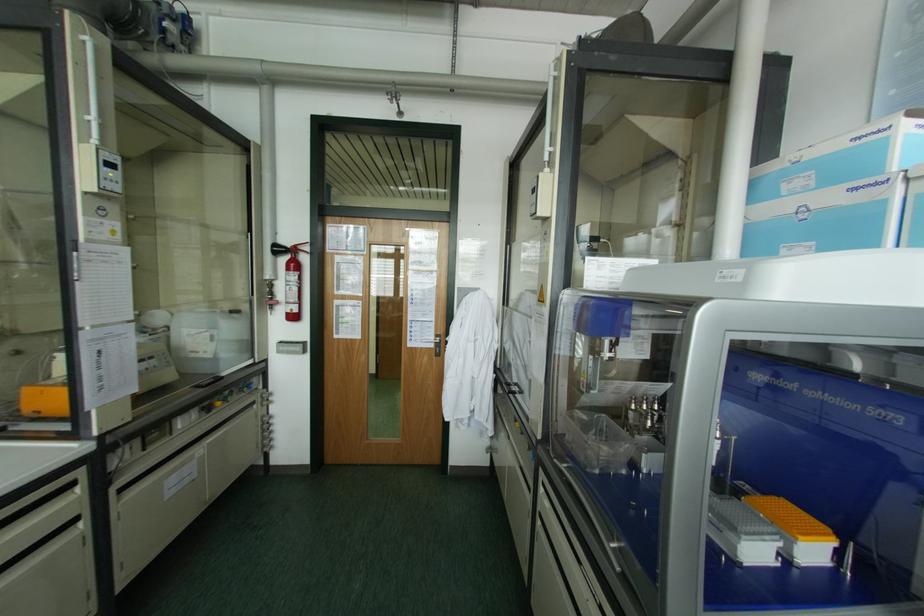
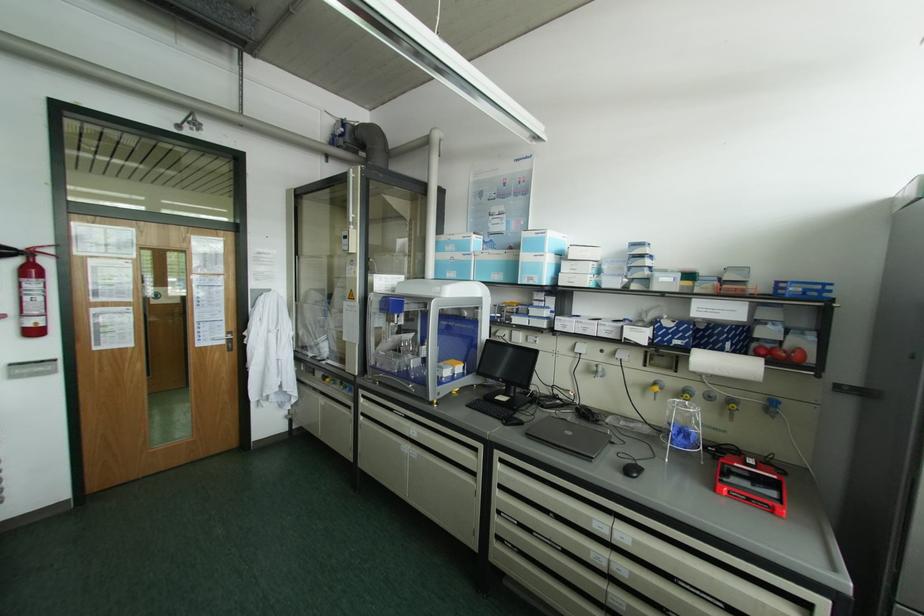
Find the pixel in the second image that matches (x=754, y=552) in the first image.

(445, 371)